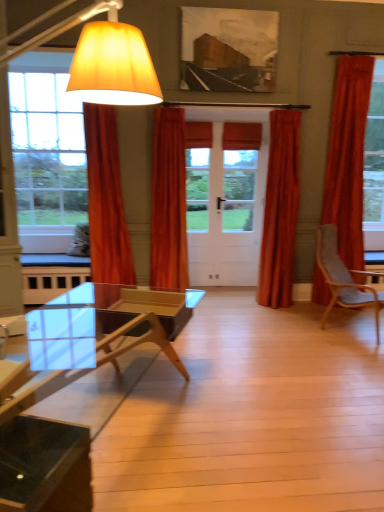
Question: Should I look upward or downward to see velvet orange curtain at right, placed as the 1th curtain when sorted from right to left?

Choices:
 (A) up
 (B) down

Answer: (A)

Question: Is the position of satin orange curtain at center, positioned as the 2th curtain in right-to-left order, less distant than that of gray fabric chair at right?

Choices:
 (A) no
 (B) yes

Answer: (A)

Question: Is gray fabric chair at right completely or partially inside satin orange curtain at center, the third curtain when ordered from left to right?

Choices:
 (A) no
 (B) yes

Answer: (A)

Question: Is satin orange curtain at center, the third curtain when ordered from left to right, outside of gray fabric chair at right?

Choices:
 (A) yes
 (B) no

Answer: (A)

Question: Can you confirm if satin orange curtain at center, positioned as the 2th curtain in right-to-left order, is thinner than gray fabric chair at right?

Choices:
 (A) no
 (B) yes

Answer: (B)

Question: From a real-world perspective, is satin orange curtain at center, positioned as the 2th curtain in right-to-left order, over gray fabric chair at right?

Choices:
 (A) yes
 (B) no

Answer: (A)

Question: Can you confirm if satin orange curtain at center, positioned as the 2th curtain in right-to-left order, is positioned to the left of gray fabric chair at right?

Choices:
 (A) no
 (B) yes

Answer: (B)

Question: Is gray fabric chair at right at the right side of matte yellow fabric lampshade at left?

Choices:
 (A) no
 (B) yes

Answer: (B)

Question: Is gray fabric chair at right bigger than matte yellow fabric lampshade at left?

Choices:
 (A) no
 (B) yes

Answer: (A)

Question: Is gray fabric chair at right positioned beyond the bounds of matte yellow fabric lampshade at left?

Choices:
 (A) yes
 (B) no

Answer: (A)

Question: Is matte yellow fabric lampshade at left surrounded by gray fabric chair at right?

Choices:
 (A) no
 (B) yes

Answer: (A)

Question: From the image's perspective, is gray fabric chair at right located above matte yellow fabric lampshade at left?

Choices:
 (A) yes
 (B) no

Answer: (B)

Question: Does gray fabric chair at right appear on the left side of matte yellow fabric lampshade at left?

Choices:
 (A) yes
 (B) no

Answer: (B)

Question: Considering the relative positions of velvet orange curtain at left, acting as the first curtain starting from the left, and velvet orange curtain at right, placed as the 1th curtain when sorted from right to left, in the image provided, is velvet orange curtain at left, acting as the first curtain starting from the left, to the right of velvet orange curtain at right, placed as the 1th curtain when sorted from right to left, from the viewer's perspective?

Choices:
 (A) no
 (B) yes

Answer: (A)